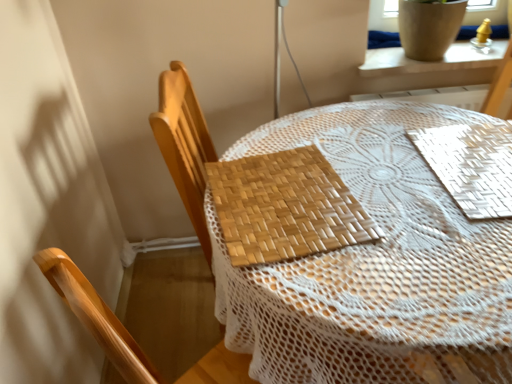
You are a GUI agent. You are given a task and a screenshot of the screen. Output one action in this format:
    pyautogui.click(x=<x>, y=<y>)
    Task: Click on the vacant space situated above woven wood placemat at center, the 2th mat positioned from the right (from a real-world perspective)
    
    Given the screenshot: What is the action you would take?
    pyautogui.click(x=287, y=207)